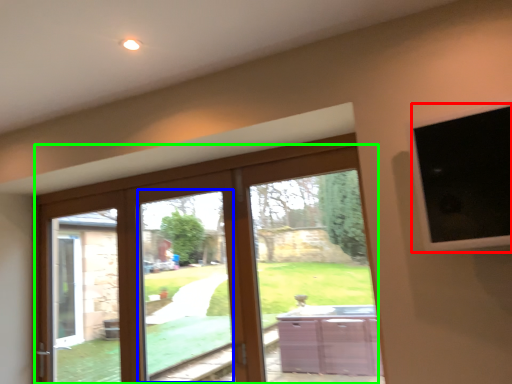
Question: Considering the real-world distances, which object is farthest from window screen (highlighted by a red box)? window (highlighted by a blue box) or door (highlighted by a green box)?

Choices:
 (A) window
 (B) door

Answer: (A)